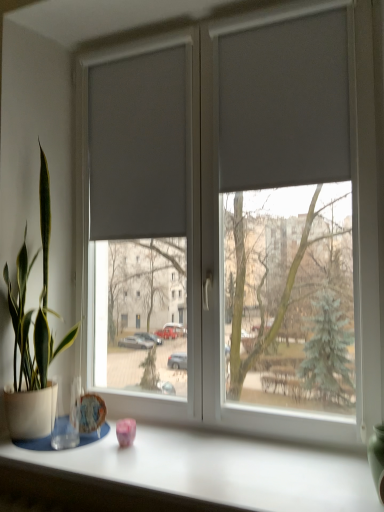
Locate an element on the screen. free location in front of green glossy plant at left is located at coordinates (58, 457).